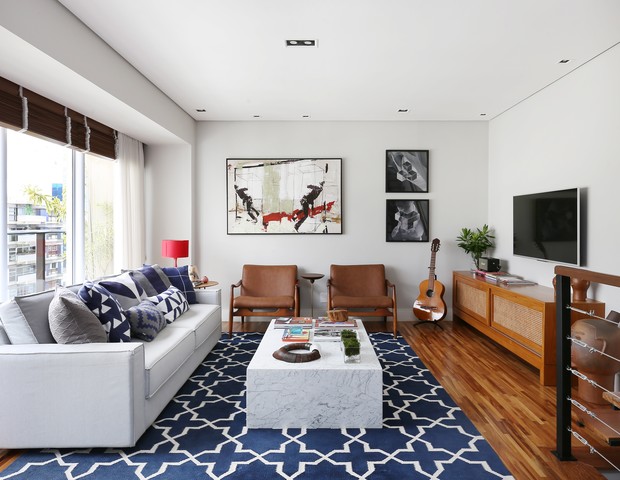
Locate an element on the screen. table is located at coordinates coord(363,394).